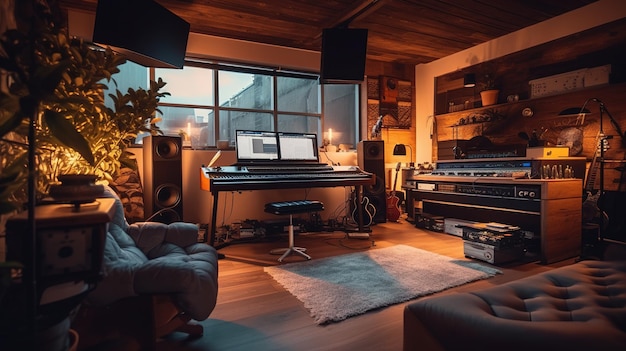
I want to click on left monitor, so click(245, 145).